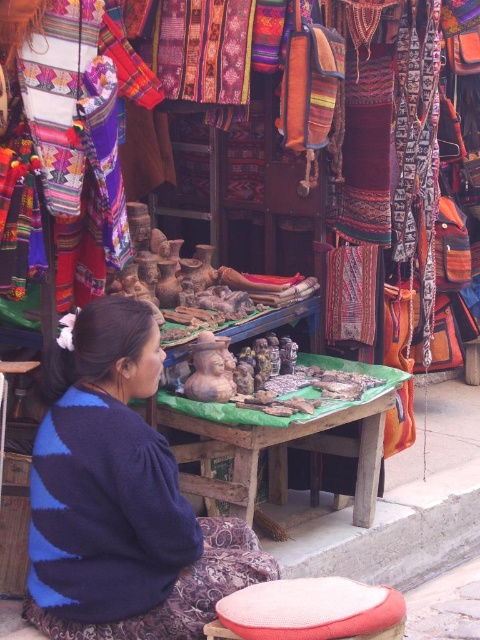
Question: Can you confirm if blue striped sweater at center is wider than red woven stool at lower center?

Choices:
 (A) no
 (B) yes

Answer: (B)

Question: Is the position of blue striped sweater at center more distant than that of red woven stool at lower center?

Choices:
 (A) yes
 (B) no

Answer: (A)

Question: Does blue striped sweater at center have a lesser width compared to red woven stool at lower center?

Choices:
 (A) no
 (B) yes

Answer: (A)

Question: Which object is closer to the camera taking this photo?

Choices:
 (A) blue striped sweater at center
 (B) red woven stool at lower center

Answer: (B)